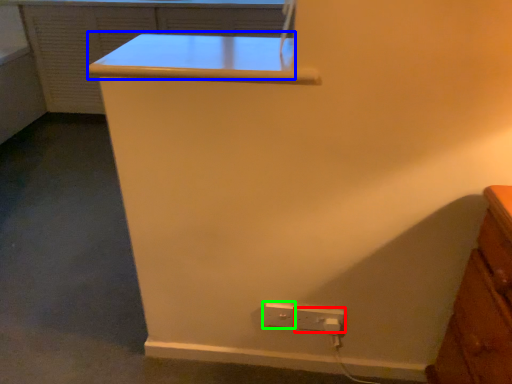
Question: Which object is positioned closest to power plugs and sockets (highlighted by a red box)? Select from table (highlighted by a blue box) and power plugs and sockets (highlighted by a green box).

Choices:
 (A) table
 (B) power plugs and sockets

Answer: (B)